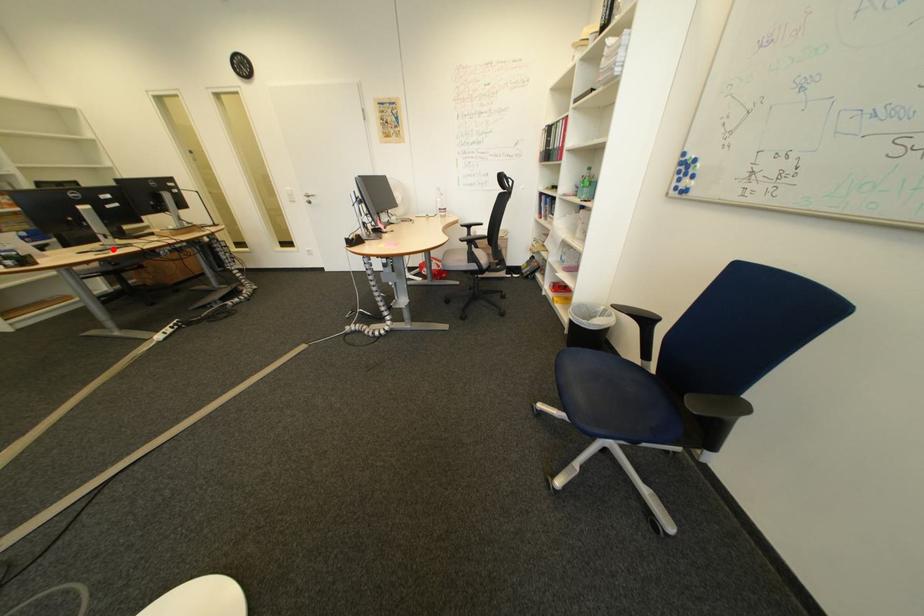
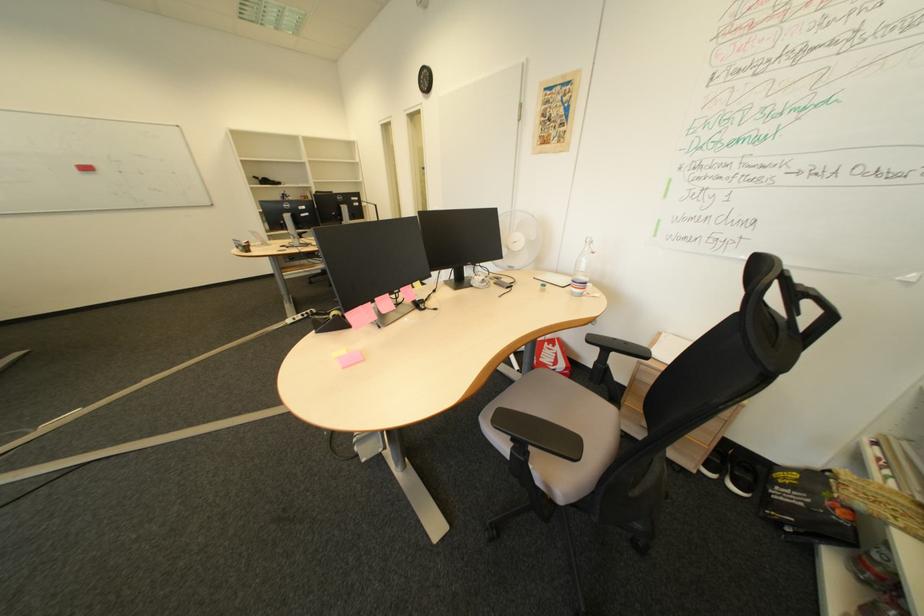
In the second image, find the point that corresponds to the highlighted location in the first image.

(301, 246)